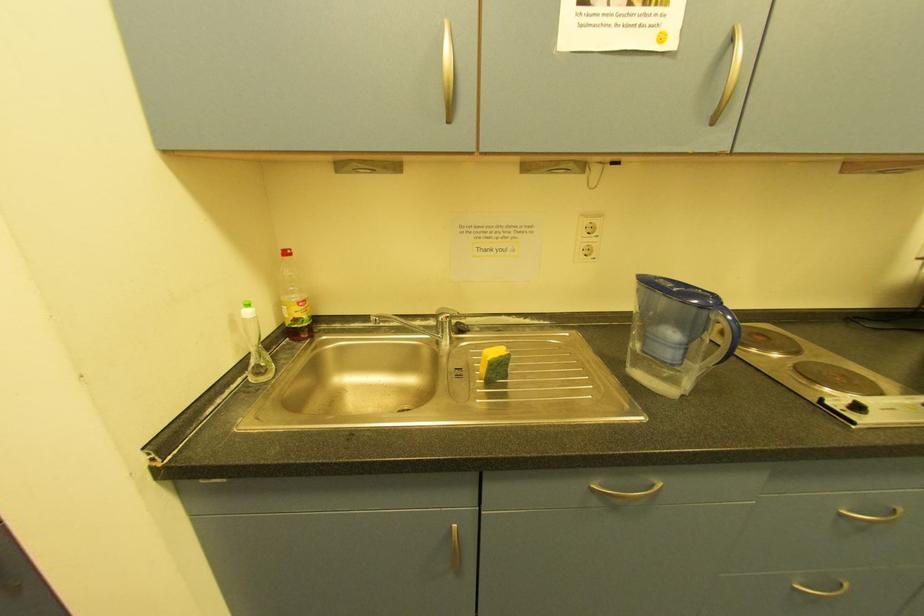
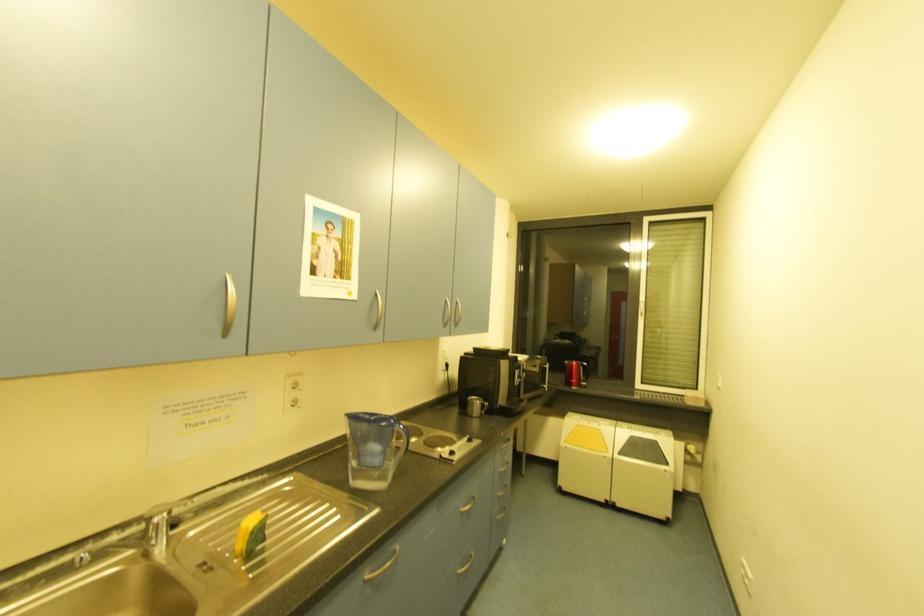
Question: The camera is either moving clockwise (left) or counter-clockwise (right) around the object. The first image is from the beginning of the video and the second image is from the end. Is the camera moving left or right when shooting the video?

Choices:
 (A) Left
 (B) Right

Answer: (A)